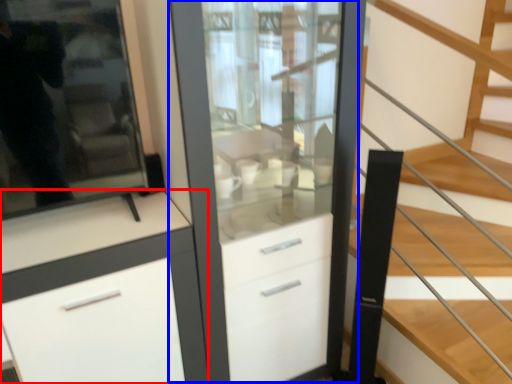
Question: Which point is closer to the camera, cabinetry (highlighted by a red box) or dresser (highlighted by a blue box)?

Choices:
 (A) cabinetry
 (B) dresser

Answer: (A)